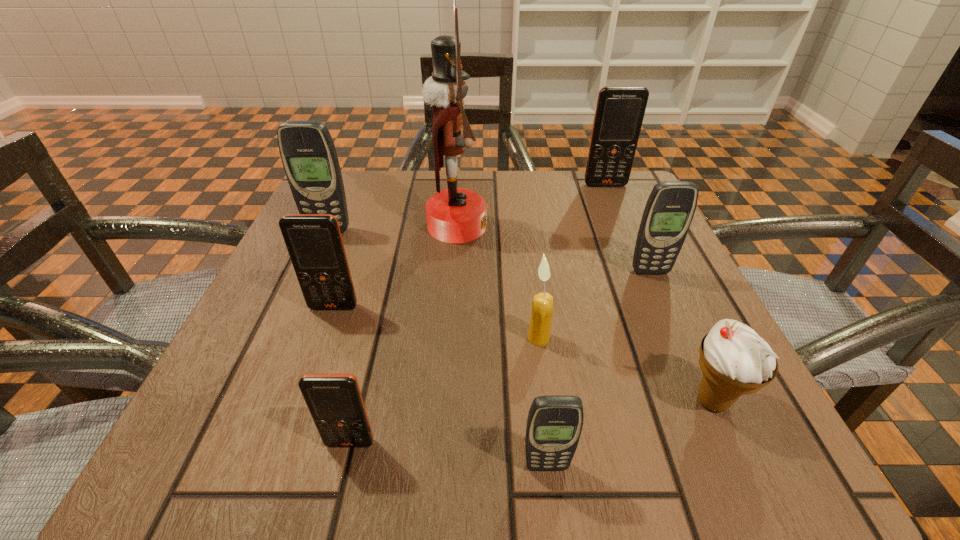
Image resolution: width=960 pixels, height=540 pixels. What are the coordinates of `cream candle` in the screenshot? It's located at (542, 305).

What are the coordinates of `the sixth farthest object` in the screenshot? It's located at (542, 305).

Where is `white icecream`? The width and height of the screenshot is (960, 540). white icecream is located at coordinates (735, 360).

This screenshot has height=540, width=960. Find the location of `the seventh farthest object`. the seventh farthest object is located at coordinates click(735, 360).

Locate an element on the screen. The image size is (960, 540). the nearest orange cellular telephone is located at coordinates (335, 402).

Locate an element on the screen. This screenshot has width=960, height=540. the fourth cellular telephone from right to left is located at coordinates (335, 402).

At what (x,y) coordinates should I click in order to perform the action: click on the nearest gray cellular telephone. Please return your answer as a coordinate pair (x, y). Looking at the image, I should click on (554, 424).

Where is `the smallest gray cellular telephone`? This screenshot has width=960, height=540. the smallest gray cellular telephone is located at coordinates (554, 424).

I want to click on free space located on the front-facing side of the nutcracker, so click(x=647, y=226).

Identify the location of free spot located 0.390m on the screen of the farthest orange cellular telephone. The image size is (960, 540). (658, 306).